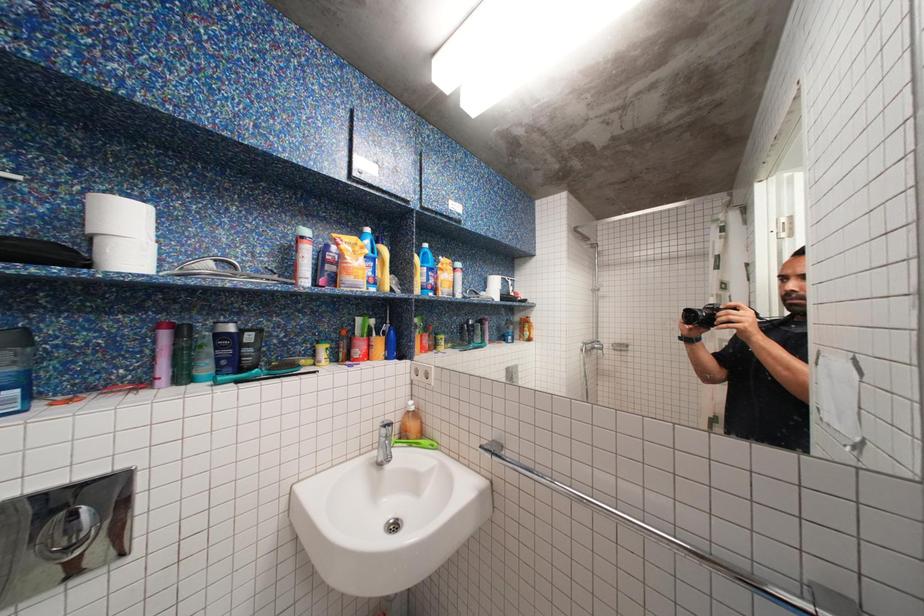
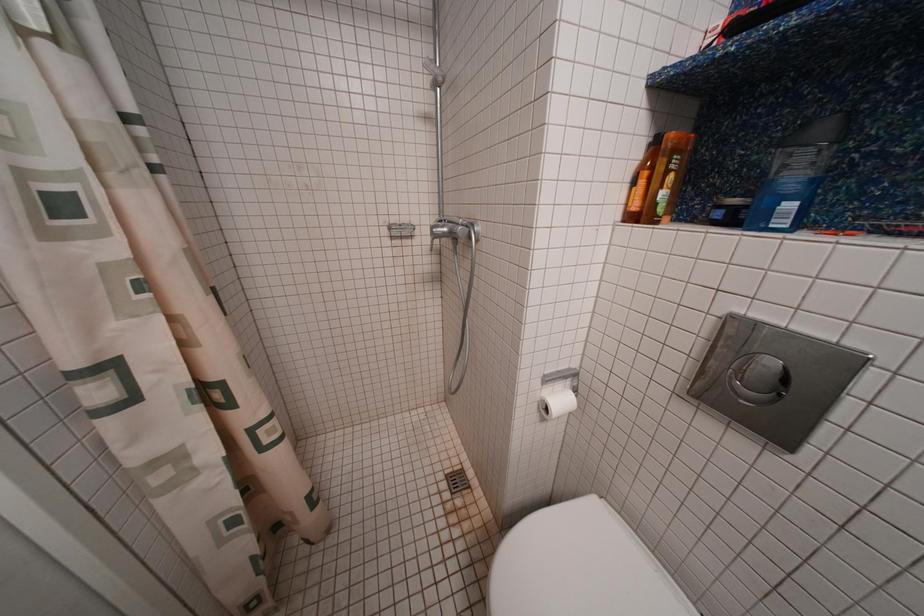
The images are taken continuously from a first-person perspective. In which direction is your viewpoint rotating?

The camera's rotation is toward left-down.